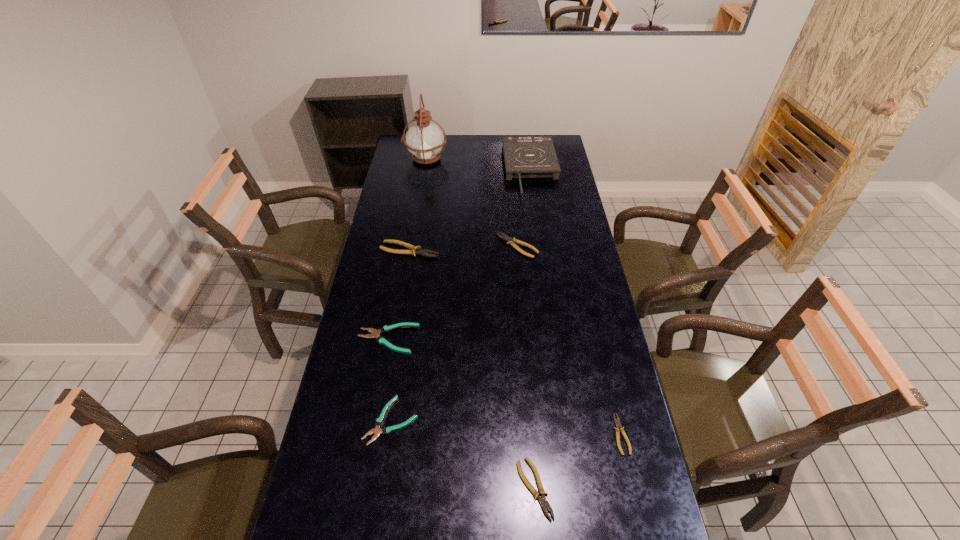
Where is `oil lamp`? oil lamp is located at coordinates (425, 140).

The width and height of the screenshot is (960, 540). What are the coordinates of `hotplate` in the screenshot? It's located at (525, 157).

Find the location of a particular element. the leftmost yellow pliers is located at coordinates (414, 250).

Find the location of `the sixth shortest object`. the sixth shortest object is located at coordinates (414, 250).

In order to click on the second tallest pliers in this screenshot , I will do `click(510, 241)`.

Locate an element on the screen. This screenshot has width=960, height=540. the fifth shortest object is located at coordinates (510, 241).

Locate an element on the screen. Image resolution: width=960 pixels, height=540 pixels. the fifth farthest object is located at coordinates (375, 334).

At what (x,y) coordinates should I click in order to perform the action: click on the farther teal pliers. Please return your answer as a coordinate pair (x, y). This screenshot has width=960, height=540. Looking at the image, I should click on (375, 334).

Where is `the nearest object`? The image size is (960, 540). the nearest object is located at coordinates pos(542,500).

This screenshot has height=540, width=960. I want to click on the third biggest yellow pliers, so (x=542, y=500).